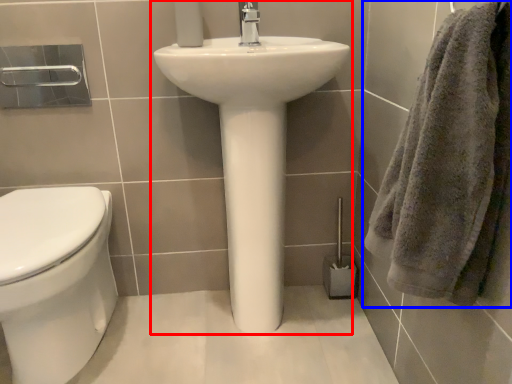
Question: Which point is closer to the camera, sink (highlighted by a red box) or towel (highlighted by a blue box)?

Choices:
 (A) sink
 (B) towel

Answer: (B)